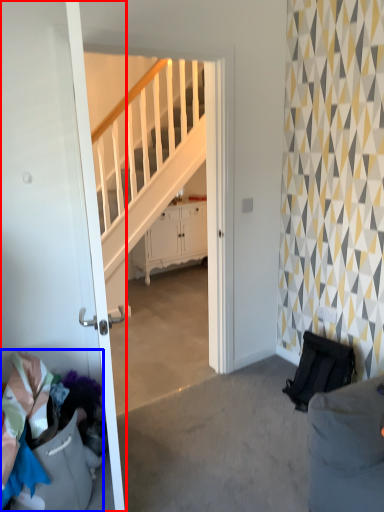
Question: Which object appears closest to the camera in this image, door (highlighted by a red box) or laundry (highlighted by a blue box)?

Choices:
 (A) door
 (B) laundry

Answer: (A)